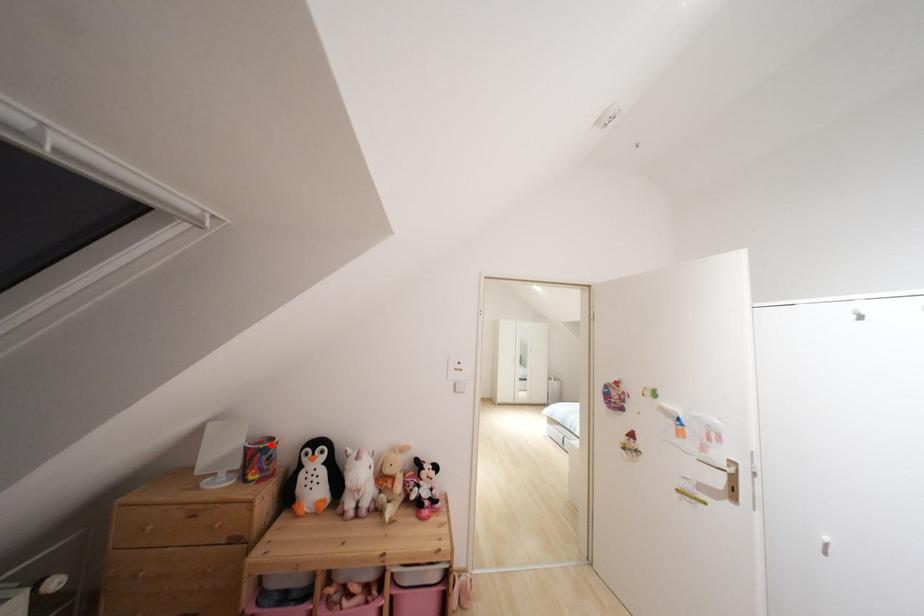
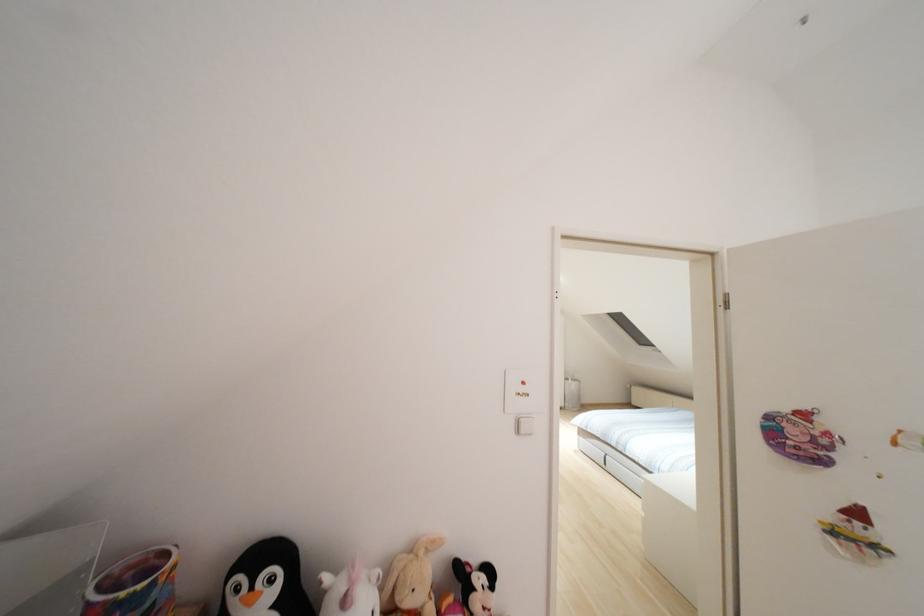
Question: I am providing you with two images of the same scene from different viewpoints. Image1 has a red point marked. In image2, the corresponding 3D location appears at what relative position? Reply with the corresponding letter.

Choices:
 (A) Closer
 (B) Farther

Answer: (A)